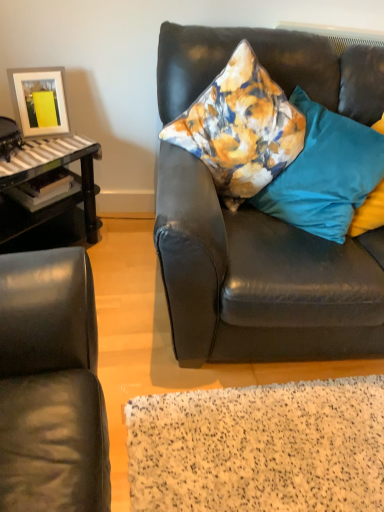
Question: Looking at the image, does floral fabric pillow at upper right, the third pillow viewed from the right, seem bigger or smaller compared to teal fabric pillow at right, which is the 1th pillow in right-to-left order?

Choices:
 (A) big
 (B) small

Answer: (A)

Question: From the image's perspective, is floral fabric pillow at upper right, acting as the first pillow starting from the left, above or below teal fabric pillow at right, the 3th pillow in the left-to-right sequence?

Choices:
 (A) below
 (B) above

Answer: (B)

Question: Based on their relative distances, which object is nearer to the matte black couch at center?

Choices:
 (A) teal fabric pillow at right, the 3th pillow in the left-to-right sequence
 (B) velvet floral pillow at center, which is the second pillow from right to left
 (C) matte white picture frame at upper left
 (D) floral fabric pillow at upper right, acting as the first pillow starting from the left

Answer: (D)

Question: Which of these objects is positioned farthest from the matte white picture frame at upper left?

Choices:
 (A) velvet floral pillow at center, which is the second pillow from right to left
 (B) teal fabric pillow at right, which is the 1th pillow in right-to-left order
 (C) matte black couch at center
 (D) floral fabric pillow at upper right, the third pillow viewed from the right

Answer: (B)